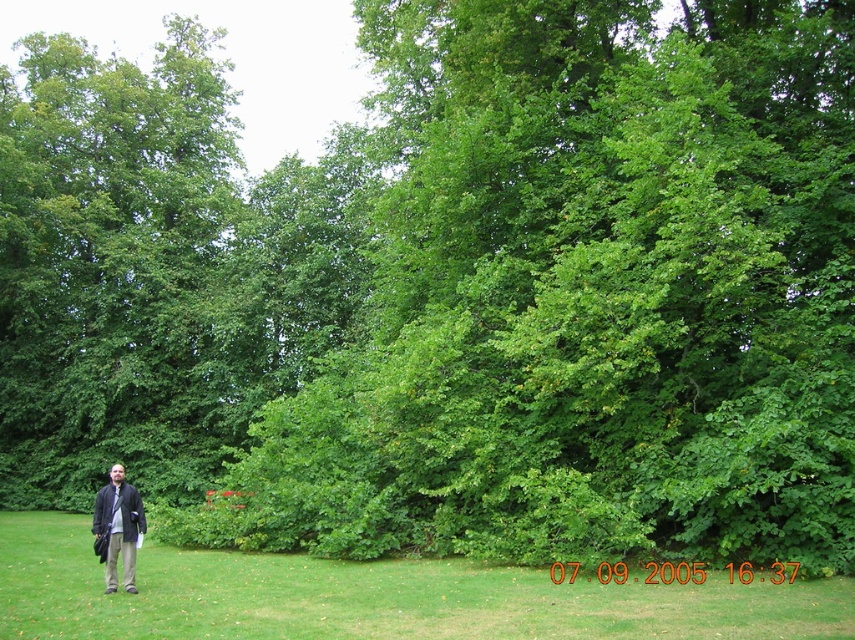
Which of these two, green grass at left or dark gray wool coat at lower left, stands shorter?

green grass at left is shorter.

Does green grass at left have a greater width compared to dark gray wool coat at lower left?

Yes, green grass at left is wider than dark gray wool coat at lower left.

Which is in front, point (523, 609) or point (118, 492)?

Point (523, 609) is more forward.

This screenshot has width=855, height=640. What are the coordinates of `green grass at left` in the screenshot? It's located at (373, 596).